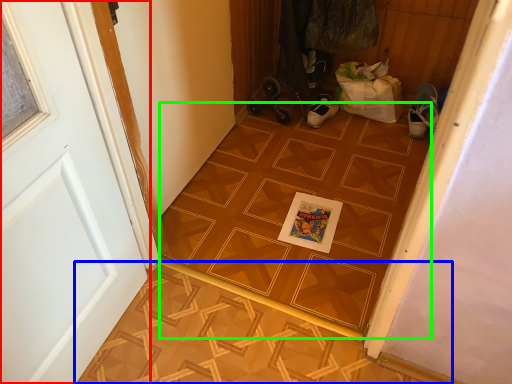
Question: Which object is the farthest from door (highlighted by a red box)? Choose among these: tile (highlighted by a blue box) or ceramic tile (highlighted by a green box).

Choices:
 (A) tile
 (B) ceramic tile

Answer: (B)